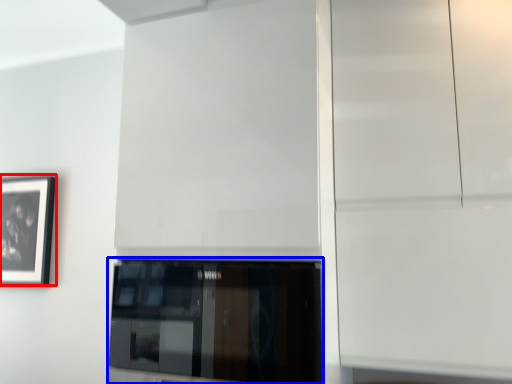
Question: Which point is closer to the camera, picture frame (highlighted by a red box) or window (highlighted by a blue box)?

Choices:
 (A) picture frame
 (B) window

Answer: (B)